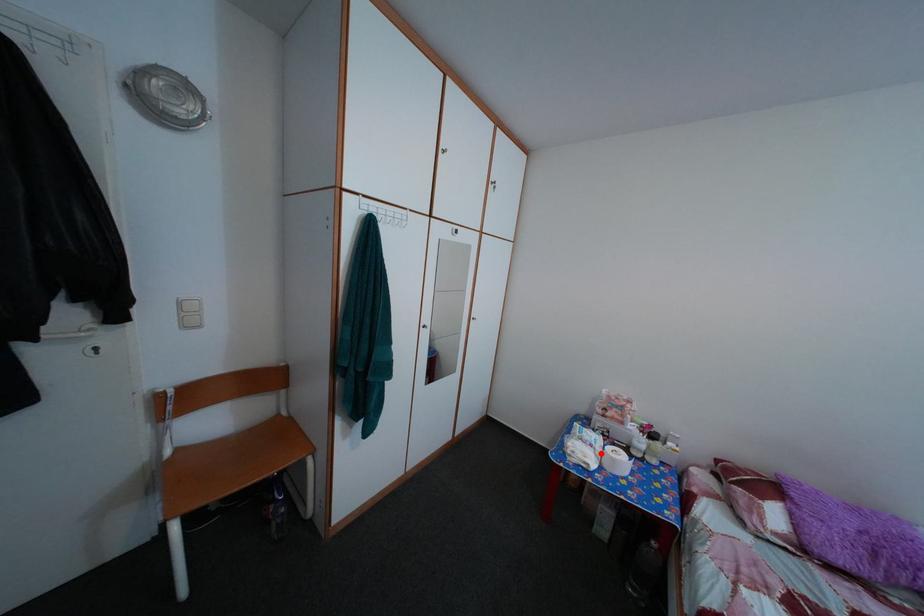
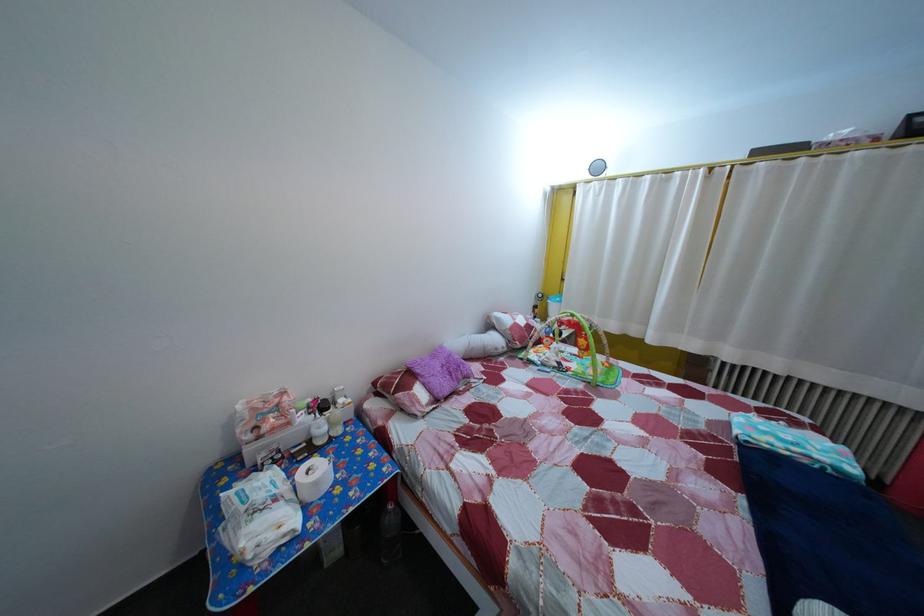
Find the pixel in the second image that matches the highlighted location in the first image.

(285, 508)